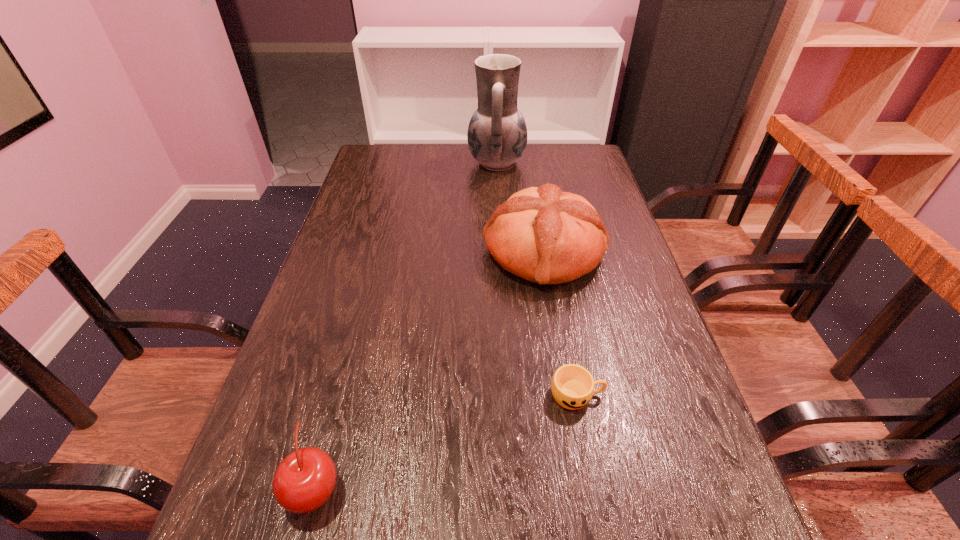
What are the coordinates of `pitcher` in the screenshot? It's located at (497, 134).

This screenshot has width=960, height=540. I want to click on the tallest object, so click(497, 134).

Where is `the third nearest object`? the third nearest object is located at coordinates (544, 235).

Find the location of a particular element. bread is located at coordinates (544, 235).

At what (x,y) coordinates should I click in order to perform the action: click on cherry. Please return your answer as a coordinate pair (x, y). Looking at the image, I should click on (305, 479).

Where is `the third tallest object`? the third tallest object is located at coordinates (305, 479).

Identify the location of cup. The width and height of the screenshot is (960, 540). (572, 386).

Locate an element on the screen. Image resolution: width=960 pixels, height=540 pixels. the third farthest object is located at coordinates (572, 386).

The width and height of the screenshot is (960, 540). Find the location of `vacant region located on the front-facing side of the pitcher`. vacant region located on the front-facing side of the pitcher is located at coordinates (420, 163).

Where is `vacant region located on the front-facing side of the pitcher`? The image size is (960, 540). vacant region located on the front-facing side of the pitcher is located at coordinates (434, 163).